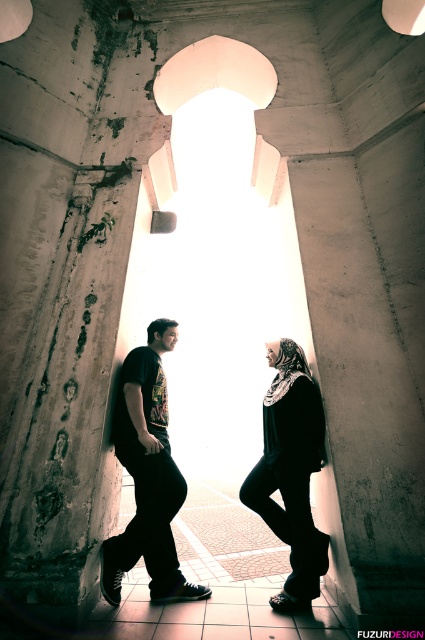
Question: Which of the following is the closest to the observer?

Choices:
 (A) (277, 428)
 (B) (306, 433)
 (C) (163, 452)

Answer: (B)

Question: Is matte black clothing at center further to camera compared to black fabric hijab at center?

Choices:
 (A) no
 (B) yes

Answer: (B)

Question: Which point is farther from the camera taking this photo?

Choices:
 (A) (306, 428)
 (B) (119, 545)
 (C) (155, 413)

Answer: (C)

Question: Which point appears farthest from the camera in this image?

Choices:
 (A) 164,433
 (B) 113,557

Answer: (A)

Question: Does matte black clothing at center appear on the right side of black fabric hijab at center?

Choices:
 (A) no
 (B) yes

Answer: (A)

Question: From the image, what is the correct spatial relationship of matte black clothing at center in relation to dark matte t-shirt at center?

Choices:
 (A) left
 (B) right

Answer: (B)